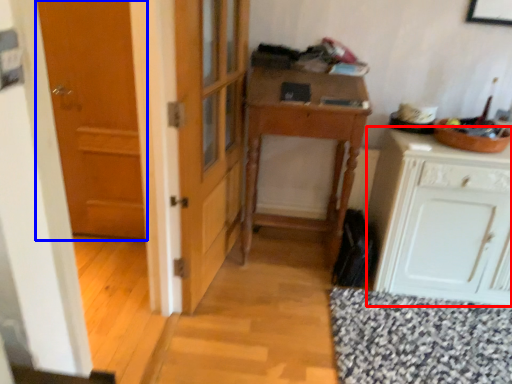
Question: Which object appears closest to the camera in this image, cabinetry (highlighted by a red box) or door (highlighted by a blue box)?

Choices:
 (A) cabinetry
 (B) door

Answer: (A)